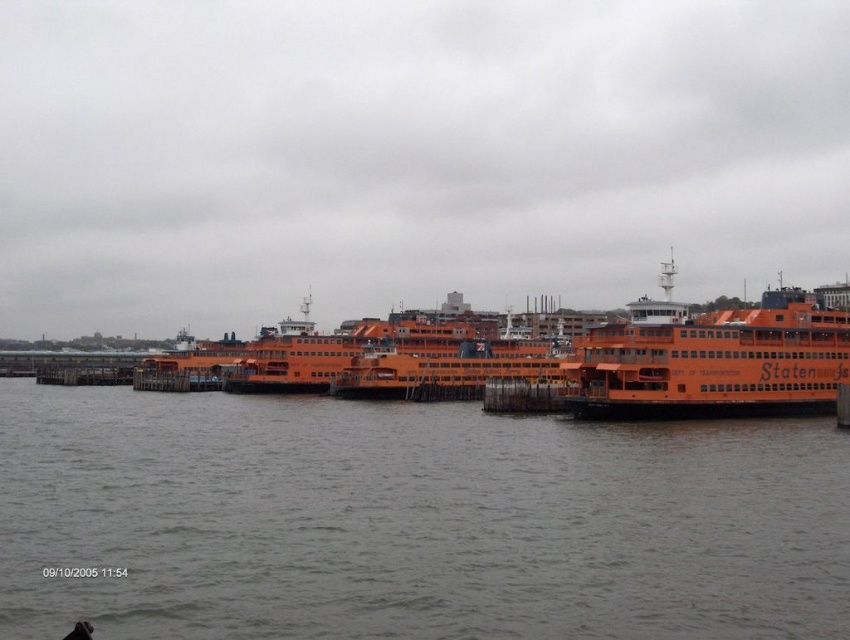
Question: Can you confirm if gray water at lower center is positioned below orange matte ferry at center?

Choices:
 (A) no
 (B) yes

Answer: (B)

Question: Does orange matte ferry at right appear over orange matte ferry at center?

Choices:
 (A) no
 (B) yes

Answer: (B)

Question: Which of these objects is positioned closest to the gray water at lower center?

Choices:
 (A) orange matte ferry at right
 (B) orange matte ferry at center

Answer: (A)

Question: Does gray water at lower center have a smaller size compared to orange matte ferry at right?

Choices:
 (A) yes
 (B) no

Answer: (B)

Question: Which of the following is the closest to the observer?

Choices:
 (A) orange matte ferry at center
 (B) orange matte ferry at right
 (C) gray water at lower center

Answer: (C)

Question: Which of these objects is positioned farthest from the gray water at lower center?

Choices:
 (A) orange matte ferry at right
 (B) orange matte ferry at center

Answer: (B)